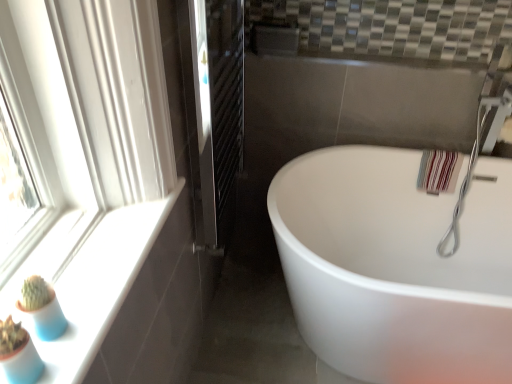
Question: From their relative heights in the image, would you say black metal radiator at center is taller or shorter than silver metallic faucet at upper right?

Choices:
 (A) short
 (B) tall

Answer: (B)

Question: Considering the positions of black metal radiator at center and silver metallic faucet at upper right in the image, is black metal radiator at center wider or thinner than silver metallic faucet at upper right?

Choices:
 (A) wide
 (B) thin

Answer: (B)

Question: Based on their relative distances, which object is farther from the black metal radiator at center?

Choices:
 (A) white glossy window sill at lower left
 (B) white glossy bathtub at center
 (C) silver metallic faucet at upper right

Answer: (C)

Question: Estimate the real-world distances between objects in this image. Which object is farther from the silver metallic faucet at upper right?

Choices:
 (A) white glossy bathtub at center
 (B) black metal radiator at center
 (C) white glossy window sill at lower left

Answer: (C)